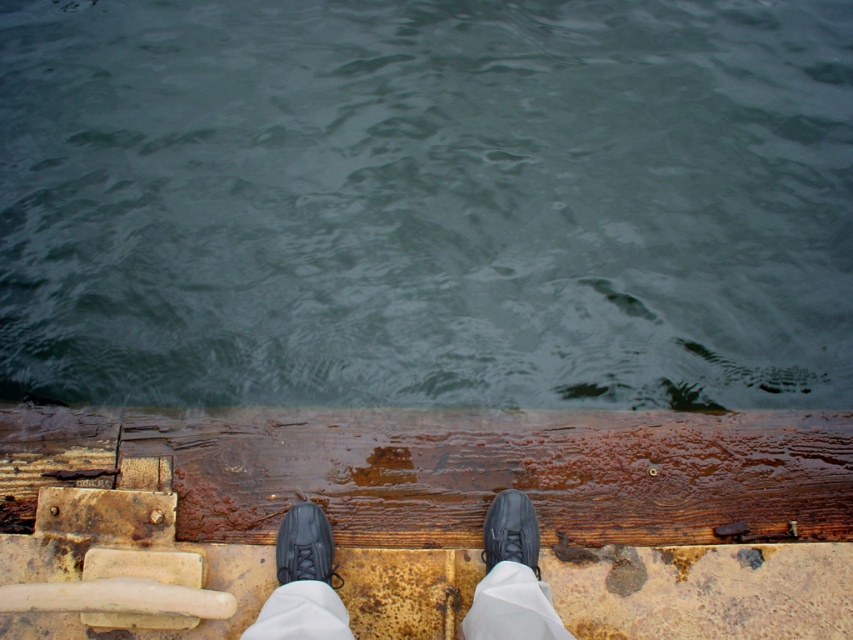
Which is above, black leather shoes at center or black leather shoe at lower center?

Positioned higher is black leather shoe at lower center.

Does point (320, 564) come closer to viewer compared to point (287, 554)?

Yes, point (320, 564) is closer to viewer.

Which is in front, point (526, 586) or point (276, 554)?

Point (526, 586) is more forward.

You are a GUI agent. You are given a task and a screenshot of the screen. Output one action in this format:
    pyautogui.click(x=<x>, y=<y>)
    Task: Click on the black leather shoes at center
    The width and height of the screenshot is (853, 640).
    Given the screenshot: What is the action you would take?
    pyautogui.click(x=511, y=577)

Does black leather shoe at lower center have a smaller size compared to black leather shoe at center?

Actually, black leather shoe at lower center might be larger than black leather shoe at center.

Does black leather shoe at lower center come in front of black leather shoe at center?

Yes, black leather shoe at lower center is closer to the viewer.

The image size is (853, 640). What do you see at coordinates (305, 545) in the screenshot?
I see `black leather shoe at lower center` at bounding box center [305, 545].

Find the location of a particular element. This screenshot has height=640, width=853. black leather shoe at lower center is located at coordinates (305, 545).

Measure the distance between point (381, 440) and camera.

Point (381, 440) and camera are 7.76 feet apart from each other.

Between rusty wood dock at center and black leather shoe at lower center, which one has less height?

With less height is black leather shoe at lower center.

Identify the location of rusty wood dock at center. (462, 509).